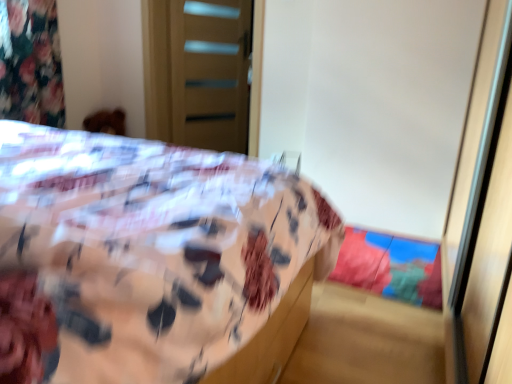
Question: Looking at their shapes, would you say floral fabric bed at center is wider or thinner than transparent plastic screen door at right, placed as the second screen door when sorted from left to right?

Choices:
 (A) wide
 (B) thin

Answer: (A)

Question: From the image's perspective, is floral fabric bed at center positioned above or below transparent plastic screen door at right, marked as the 1th screen door in a right-to-left arrangement?

Choices:
 (A) above
 (B) below

Answer: (B)

Question: Estimate the real-world distances between objects in this image. Which object is closer to the wooden door at upper center, which ranks as the 2th screen door in right-to-left order?

Choices:
 (A) transparent plastic screen door at right, marked as the 1th screen door in a right-to-left arrangement
 (B) floral fabric bed at center

Answer: (B)

Question: Which of these objects is positioned farthest from the wooden door at upper center, the second screen door when ordered from front to back?

Choices:
 (A) transparent plastic screen door at right, placed as the second screen door when sorted from left to right
 (B) floral fabric bed at center

Answer: (A)